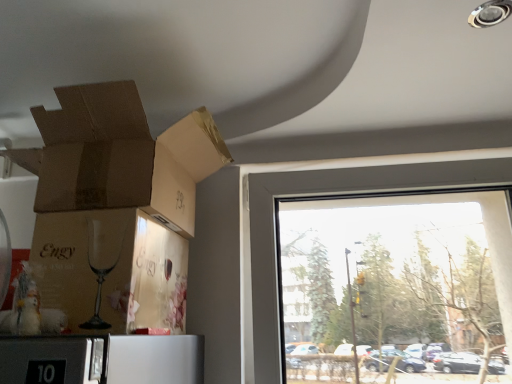
Question: Should I look upward or downward to see transparent glass window at right?

Choices:
 (A) down
 (B) up

Answer: (A)

Question: Is transparent glass window at right not inside brown cardboard box at upper left, marked as the first cardboard box in a top-to-bottom arrangement?

Choices:
 (A) no
 (B) yes

Answer: (B)

Question: Can you see transparent glass window at right touching brown cardboard box at upper left, which is the second cardboard box from bottom to top?

Choices:
 (A) yes
 (B) no

Answer: (B)

Question: Is transparent glass window at right surrounding brown cardboard box at upper left, which is the second cardboard box from bottom to top?

Choices:
 (A) no
 (B) yes

Answer: (A)

Question: Does transparent glass window at right have a larger size compared to brown cardboard box at upper left, marked as the first cardboard box in a top-to-bottom arrangement?

Choices:
 (A) no
 (B) yes

Answer: (B)

Question: Is transparent glass window at right positioned in front of brown cardboard box at upper left, marked as the first cardboard box in a top-to-bottom arrangement?

Choices:
 (A) yes
 (B) no

Answer: (B)

Question: From a real-world perspective, is transparent glass window at right physically above brown cardboard box at upper left, marked as the first cardboard box in a top-to-bottom arrangement?

Choices:
 (A) yes
 (B) no

Answer: (B)

Question: Is matte brown cardboard at lower left, acting as the 2th cardboard box starting from the top, shorter than brown cardboard box at upper left, which is the second cardboard box from bottom to top?

Choices:
 (A) no
 (B) yes

Answer: (A)

Question: Would you say matte brown cardboard at lower left, acting as the 2th cardboard box starting from the top, is a long distance from brown cardboard box at upper left, which is the second cardboard box from bottom to top?

Choices:
 (A) yes
 (B) no

Answer: (B)

Question: From the image's perspective, is matte brown cardboard at lower left, acting as the 2th cardboard box starting from the top, above brown cardboard box at upper left, which is the second cardboard box from bottom to top?

Choices:
 (A) yes
 (B) no

Answer: (B)

Question: From a real-world perspective, is matte brown cardboard at lower left, acting as the 2th cardboard box starting from the top, on brown cardboard box at upper left, which is the second cardboard box from bottom to top?

Choices:
 (A) yes
 (B) no

Answer: (B)

Question: Is matte brown cardboard at lower left, acting as the 1th cardboard box starting from the bottom, beside brown cardboard box at upper left, which is the second cardboard box from bottom to top?

Choices:
 (A) yes
 (B) no

Answer: (B)

Question: Does matte brown cardboard at lower left, acting as the 1th cardboard box starting from the bottom, appear on the left side of brown cardboard box at upper left, marked as the first cardboard box in a top-to-bottom arrangement?

Choices:
 (A) yes
 (B) no

Answer: (A)

Question: Considering the relative sizes of transparent glass window at right and matte brown cardboard at lower left, acting as the 1th cardboard box starting from the bottom, in the image provided, is transparent glass window at right bigger than matte brown cardboard at lower left, acting as the 1th cardboard box starting from the bottom,?

Choices:
 (A) yes
 (B) no

Answer: (A)